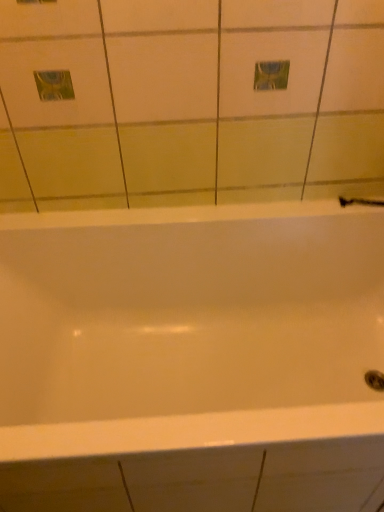
Identify the location of vacant space situated on the left part of white glossy shower at right. Image resolution: width=384 pixels, height=512 pixels. (311, 208).